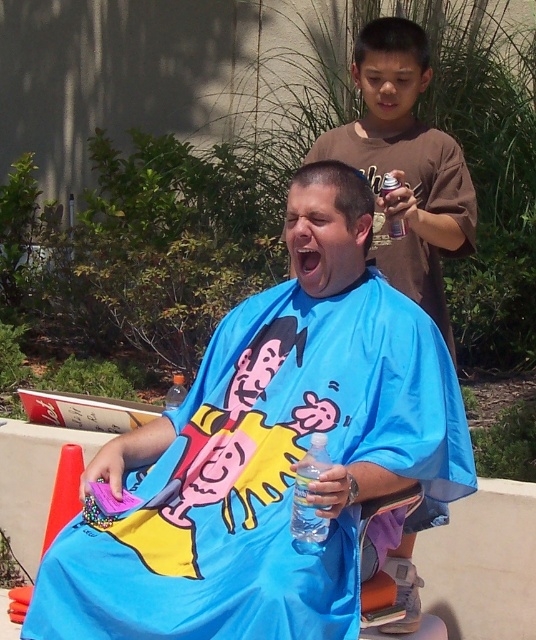
Question: Does blue fabric cape at center have a greater width compared to brown cotton shirt at upper right?

Choices:
 (A) no
 (B) yes

Answer: (B)

Question: Which point is closer to the camera?

Choices:
 (A) blue fabric cape at center
 (B) brown cotton shirt at upper right

Answer: (A)

Question: Is blue fabric cape at center closer to camera compared to brown cotton shirt at upper right?

Choices:
 (A) yes
 (B) no

Answer: (A)

Question: Which point is farther from the camera taking this photo?

Choices:
 (A) tap(312, 404)
 (B) tap(445, 205)

Answer: (B)

Question: Is blue fabric cape at center smaller than brown cotton shirt at upper right?

Choices:
 (A) yes
 (B) no

Answer: (B)